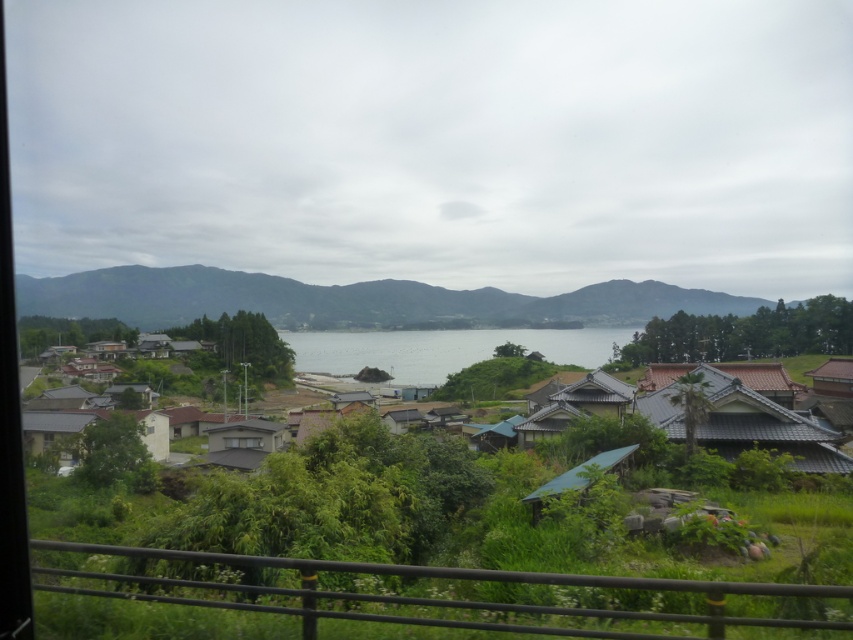
Question: Can you confirm if green matte mountain at center is smaller than brown corrugated roof at right?

Choices:
 (A) no
 (B) yes

Answer: (A)

Question: Which point is farther from the camera taking this photo?

Choices:
 (A) (627, 445)
 (B) (820, 392)
 (C) (573, 301)
 (D) (506, 442)

Answer: (C)

Question: Is dark gray tiled roof at lower right above brown corrugated roof at right?

Choices:
 (A) yes
 (B) no

Answer: (A)

Question: Based on their relative distances, which object is nearer to the brown tiled roofs at center?

Choices:
 (A) clear water at center
 (B) brown corrugated roof at right

Answer: (A)

Question: Can you confirm if green matte mountain at center is positioned above transparent glass window at center?

Choices:
 (A) no
 (B) yes

Answer: (B)

Question: Which object is farther from the camera taking this photo?

Choices:
 (A) brown tiled roofs at center
 (B) green matte mountain at center
 (C) dark gray tiled roof at lower right
 (D) transparent glass window at center

Answer: (D)